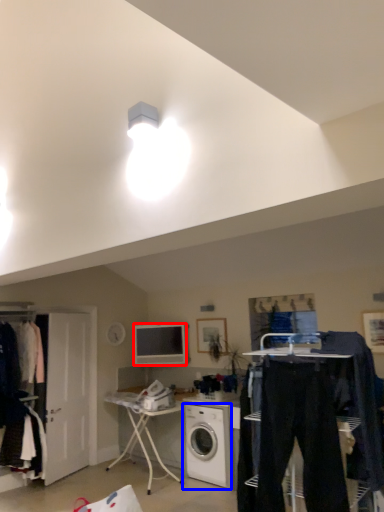
Question: Which object is further to the camera taking this photo, television (highlighted by a red box) or washing machine (highlighted by a blue box)?

Choices:
 (A) television
 (B) washing machine

Answer: (A)